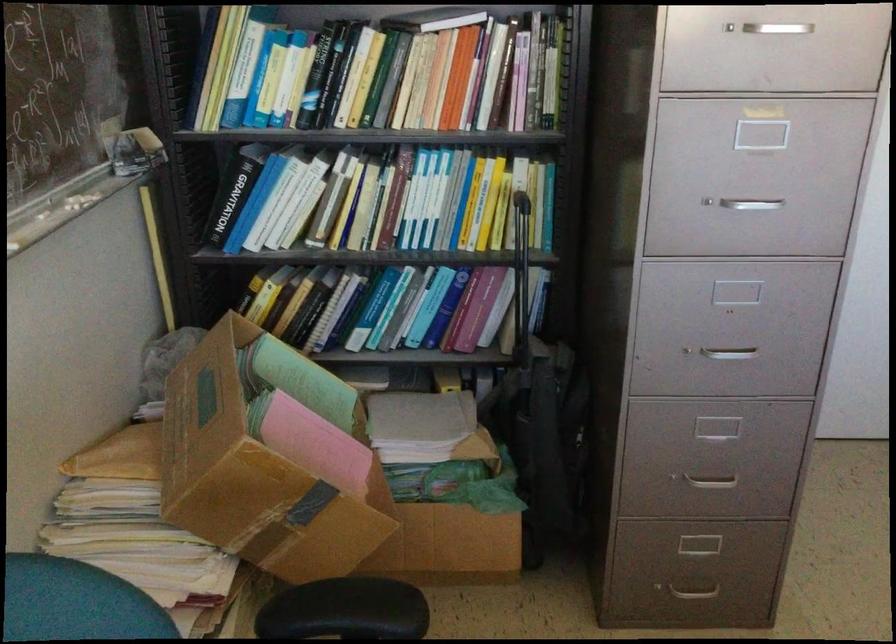
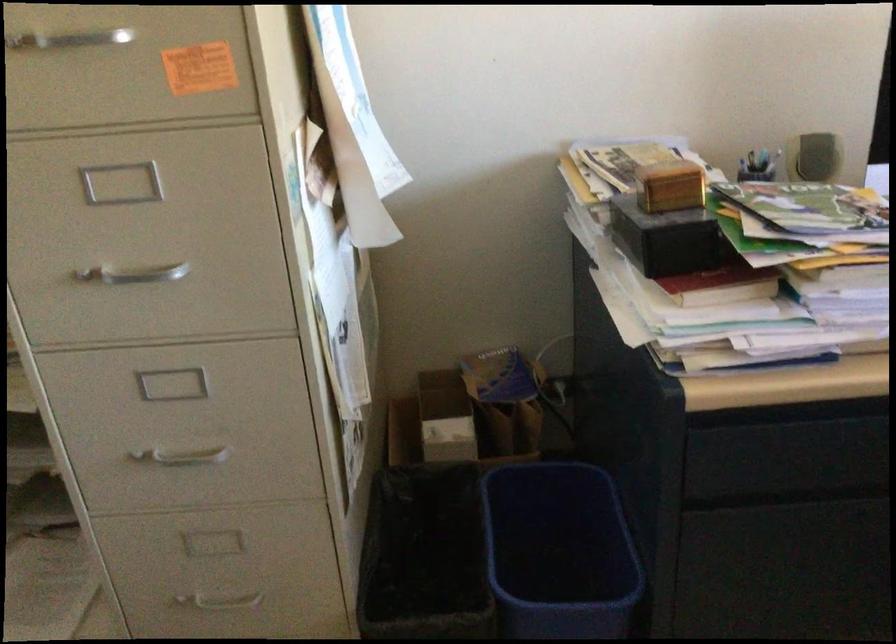
The first image is from the beginning of the video and the second image is from the end. How did the camera likely rotate when shooting the video?

The camera rotated toward right-down.